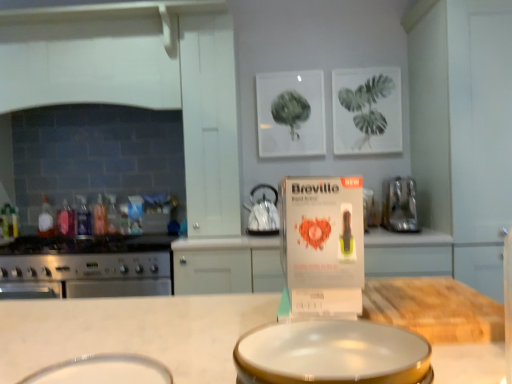
Question: Should I look upward or downward to see translucent plastic bottle at stove left, the fifth bottle positioned from the left?

Choices:
 (A) up
 (B) down

Answer: (B)

Question: Is white glossy basin at lower center, which ranks as the 2th basin in right-to-left order, facing away from translucent plastic bottle at stove left, which appears as the 3th bottle when viewed from the left?

Choices:
 (A) no
 (B) yes

Answer: (B)

Question: Considering the relative sizes of white glossy basin at lower center, which ranks as the 2th basin in right-to-left order, and translucent plastic bottle at stove left, which appears as the 3th bottle when viewed from the left, in the image provided, is white glossy basin at lower center, which ranks as the 2th basin in right-to-left order, taller than translucent plastic bottle at stove left, which appears as the 3th bottle when viewed from the left,?

Choices:
 (A) no
 (B) yes

Answer: (A)

Question: From a real-world perspective, is white glossy basin at lower center, which ranks as the first basin in left-to-right order, over translucent plastic bottle at stove left, the 3th bottle in the right-to-left sequence?

Choices:
 (A) yes
 (B) no

Answer: (B)

Question: Considering the relative sizes of white glossy basin at lower center, which ranks as the first basin in left-to-right order, and translucent plastic bottle at stove left, the 3th bottle in the right-to-left sequence, in the image provided, is white glossy basin at lower center, which ranks as the first basin in left-to-right order, shorter than translucent plastic bottle at stove left, the 3th bottle in the right-to-left sequence,?

Choices:
 (A) no
 (B) yes

Answer: (B)

Question: Is white glossy basin at lower center, which ranks as the first basin in left-to-right order, oriented towards translucent plastic bottle at stove left, which appears as the 3th bottle when viewed from the left?

Choices:
 (A) yes
 (B) no

Answer: (B)

Question: From the image's perspective, does white glossy basin at lower center, which ranks as the 2th basin in right-to-left order, appear lower than translucent plastic bottle at stove left, which appears as the 3th bottle when viewed from the left?

Choices:
 (A) yes
 (B) no

Answer: (A)

Question: Is satin black kettle at center, which is counted as the 2th kitchen appliance, starting from the left, at the left side of translucent plastic bottle at left, the second bottle from the left?

Choices:
 (A) yes
 (B) no

Answer: (B)

Question: Is satin black kettle at center, positioned as the second kitchen appliance in right-to-left order, outside translucent plastic bottle at left, positioned as the 4th bottle in right-to-left order?

Choices:
 (A) yes
 (B) no

Answer: (A)

Question: Is the depth of satin black kettle at center, positioned as the second kitchen appliance in right-to-left order, greater than that of translucent plastic bottle at left, positioned as the 4th bottle in right-to-left order?

Choices:
 (A) yes
 (B) no

Answer: (B)

Question: Does satin black kettle at center, positioned as the second kitchen appliance in right-to-left order, have a lesser width compared to translucent plastic bottle at left, the second bottle from the left?

Choices:
 (A) no
 (B) yes

Answer: (A)

Question: From the image's perspective, is satin black kettle at center, positioned as the second kitchen appliance in right-to-left order, beneath translucent plastic bottle at left, the second bottle from the left?

Choices:
 (A) yes
 (B) no

Answer: (B)

Question: Considering the relative sizes of satin black kettle at center, which is counted as the 2th kitchen appliance, starting from the left, and translucent plastic bottle at left, the second bottle from the left, in the image provided, is satin black kettle at center, which is counted as the 2th kitchen appliance, starting from the left, shorter than translucent plastic bottle at left, the second bottle from the left,?

Choices:
 (A) yes
 (B) no

Answer: (B)

Question: Would you say translucent plastic bottle at stove left, which appears as the 3th bottle when viewed from the left, is outside satin black kettle at center, which is counted as the 2th kitchen appliance, starting from the left?

Choices:
 (A) no
 (B) yes

Answer: (B)